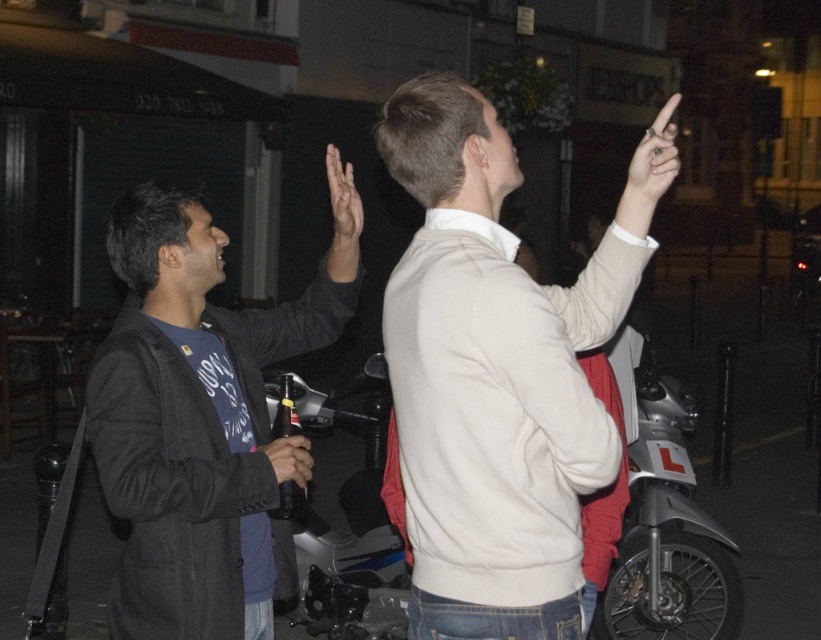
You are a photographer trying to capture a candid shot of the light beige sweater at upper right and the smooth skin hand at upper right. Which object should you focus on first to ensure both are in sharp focus?

The light beige sweater at upper right is in front of the smooth skin hand at upper right, so you should focus on the light beige sweater at upper right first to ensure both are in sharp focus.

You are a photographer trying to capture a candid shot of the dark gray jacket at left and the matte skin hand at upper center. Since you want to ensure both are in focus, you need to know their relative sizes. Which object is smaller?

The dark gray jacket at left is smaller in size compared to the matte skin hand at upper center according to the description.